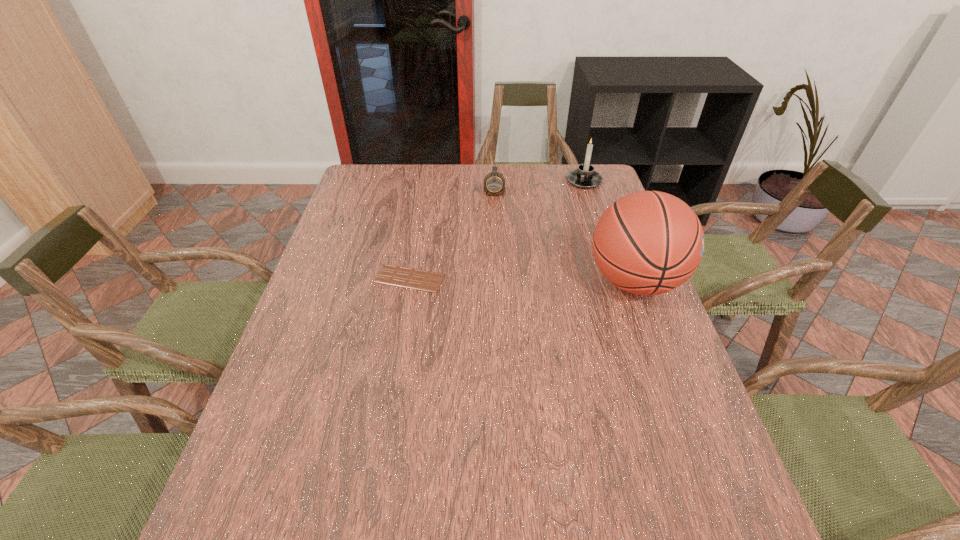
Find the location of `the leftmost object`. the leftmost object is located at coordinates (428, 281).

The height and width of the screenshot is (540, 960). I want to click on chocolate bar, so click(428, 281).

Find the location of a particular element. the tallest object is located at coordinates [649, 242].

Find the location of a particular element. The width and height of the screenshot is (960, 540). the third shortest object is located at coordinates (585, 177).

Where is `the third object from right to left`? the third object from right to left is located at coordinates (494, 183).

Image resolution: width=960 pixels, height=540 pixels. I want to click on compass, so click(x=494, y=183).

Identify the location of vacant space located on the back of the leftmost object. This screenshot has height=540, width=960. (417, 237).

At what (x,y) coordinates should I click in order to perform the action: click on free location located with a handle on the side of the second tallest object. Please return your answer as a coordinate pair (x, y). Looking at the image, I should click on (569, 210).

I want to click on free space located with a handle on the side of the second tallest object, so click(545, 258).

Identify the location of vacant space located with a handle on the side of the second tallest object. This screenshot has height=540, width=960. (547, 254).